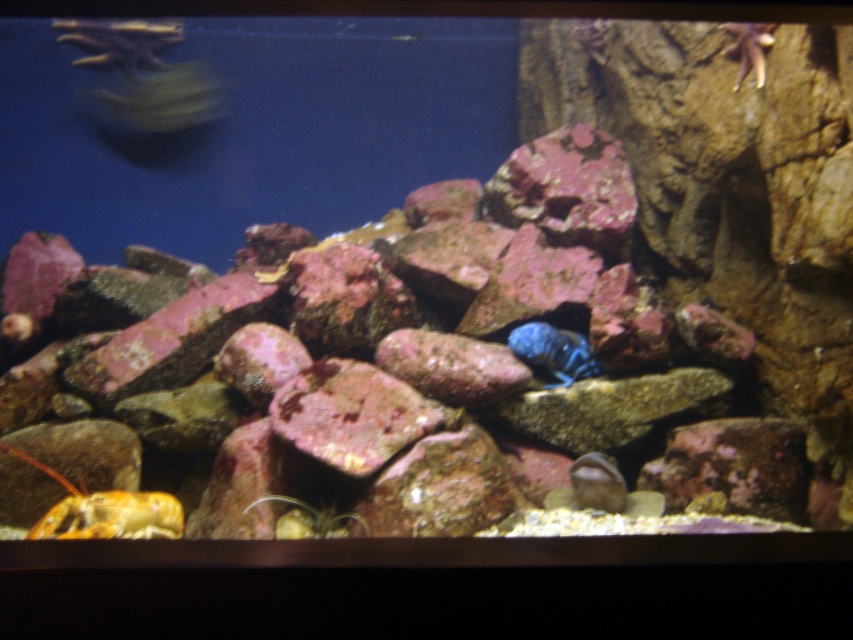
Can you confirm if shiny orange hermit crab at lower left is positioned above blue glossy fish at center?

No.

Locate an element on the screen. This screenshot has width=853, height=640. shiny orange hermit crab at lower left is located at coordinates (103, 509).

Does point (112, 524) come in front of point (589, 369)?

Yes.

This screenshot has width=853, height=640. What are the coordinates of `shiny orange hermit crab at lower left` in the screenshot? It's located at (103, 509).

Who is positioned more to the left, shiny orange hermit crab at lower left or matte brown rock at lower center?

shiny orange hermit crab at lower left is more to the left.

Which of these two, shiny orange hermit crab at lower left or matte brown rock at lower center, stands taller?

shiny orange hermit crab at lower left

Does point (74, 502) lie behind point (581, 465)?

No, (74, 502) is closer to viewer.

Identify the location of shiny orange hermit crab at lower left. The width and height of the screenshot is (853, 640). (103, 509).

Is blue glossy fish at center bigger than matte brown rock at lower center?

Yes.

How far apart are blue glossy fish at center and matte brown rock at lower center?

They are 10.62 inches apart.

I want to click on blue glossy fish at center, so click(553, 352).

Where is `blue glossy fish at center`? Image resolution: width=853 pixels, height=640 pixels. blue glossy fish at center is located at coordinates (553, 352).